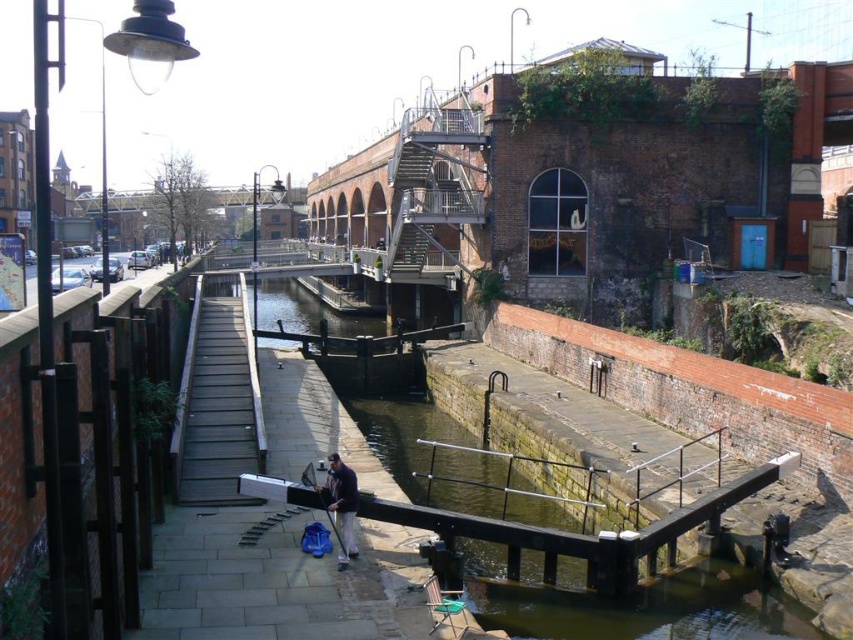
From the picture: You are a maintenance worker needing to place a 1.5 meter wide equipment on the wooden planks dock at center or the dark blue fabric at center. Which surface can accommodate it based on their widths?

The wooden planks dock at center has a greater width than the dark blue fabric at center. Therefore, the equipment can be placed on the wooden planks dock at center since it is wider than the dark blue fabric at center.

You are standing at the edge of the canal looking towards the lock system. There are two points marked in the scene, one at coordinates point (259,404) and another at point (328,488). Which of these points is closer to your current position?

Point (259,404) is closer to your current position because it is further to the viewer than point (328,488).